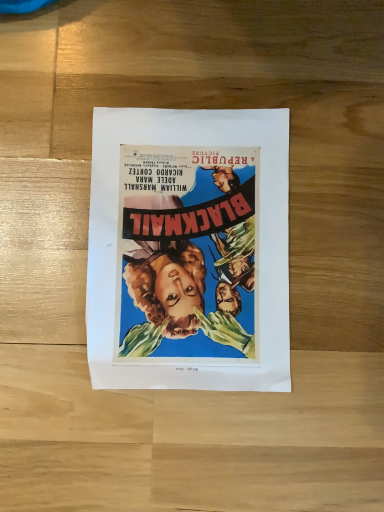
Where is `empty space that is ontop of matte paper poster at center`? This screenshot has height=512, width=384. empty space that is ontop of matte paper poster at center is located at coordinates (188, 248).